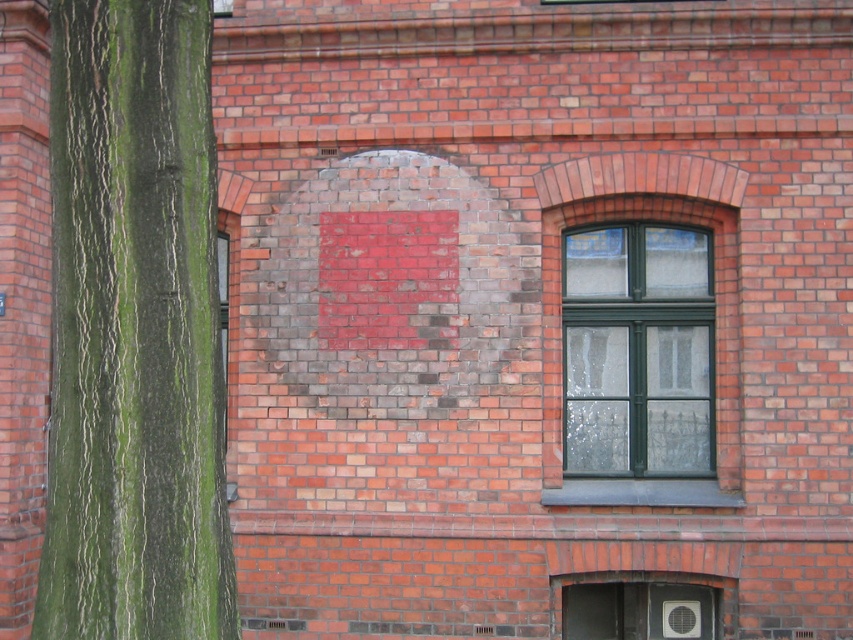
Question: From the image, what is the correct spatial relationship of green rough bark tree trunk at left in relation to green glass window at center?

Choices:
 (A) left
 (B) right

Answer: (A)

Question: Is green rough bark tree trunk at left to the left of green glass window at center from the viewer's perspective?

Choices:
 (A) no
 (B) yes

Answer: (B)

Question: Can you confirm if green rough bark tree trunk at left is positioned to the right of green glass window at center?

Choices:
 (A) no
 (B) yes

Answer: (A)